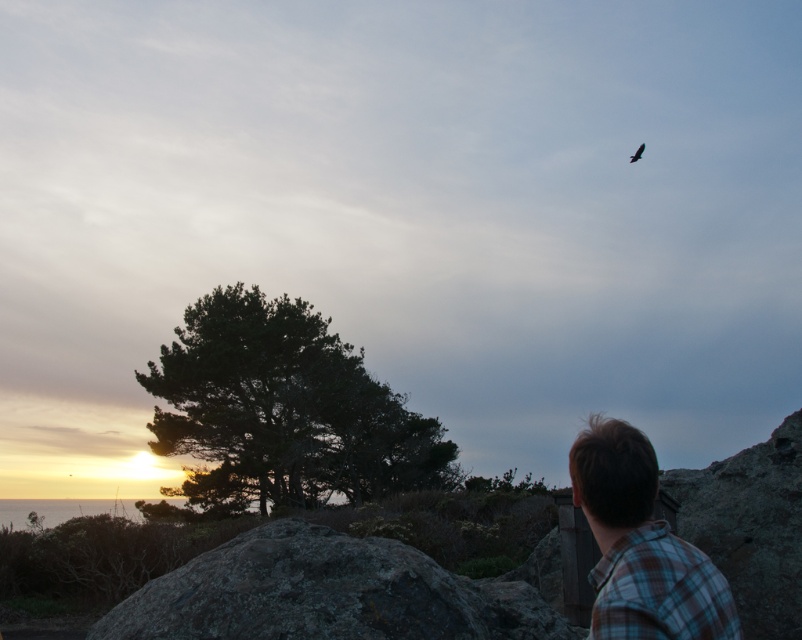
Question: Which object is closer to the camera taking this photo?

Choices:
 (A) dark brown feathered bird at upper right
 (B) plaid fabric shirt at lower right
 (C) dark green textured tree at center-left

Answer: (B)

Question: Among these points, which one is farthest from the camera?

Choices:
 (A) tap(578, 456)
 (B) tap(278, 456)
 (C) tap(638, 145)

Answer: (C)

Question: Does dark green textured tree at center-left appear under dark brown feathered bird at upper right?

Choices:
 (A) no
 (B) yes

Answer: (B)

Question: Can you confirm if plaid fabric shirt at lower right is bigger than dark brown feathered bird at upper right?

Choices:
 (A) yes
 (B) no

Answer: (B)

Question: Can you confirm if plaid fabric shirt at lower right is wider than dark brown feathered bird at upper right?

Choices:
 (A) no
 (B) yes

Answer: (A)

Question: Which point appears closest to the camera in this image?

Choices:
 (A) (697, 627)
 (B) (630, 157)
 (C) (308, 426)

Answer: (A)